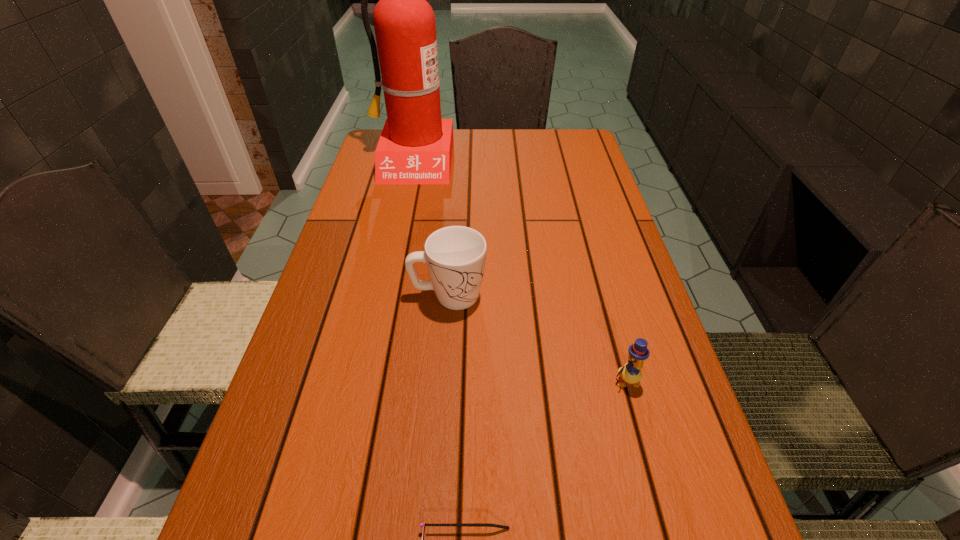
At what (x,y) coordinates should I click in order to perform the action: click on the tallest object. Please return your answer as a coordinate pair (x, y). Looking at the image, I should click on (415, 147).

You are a GUI agent. You are given a task and a screenshot of the screen. Output one action in this format:
    pyautogui.click(x=<x>, y=<y>)
    Task: Click on the farthest object
    
    Given the screenshot: What is the action you would take?
    pyautogui.click(x=415, y=147)

This screenshot has height=540, width=960. I want to click on mug, so click(x=455, y=256).

Find the location of `the second farthest object`. the second farthest object is located at coordinates (455, 256).

You are a GUI agent. You are given a task and a screenshot of the screen. Output one action in this format:
    pyautogui.click(x=<x>, y=<y>)
    Task: Click on the duckling
    
    Given the screenshot: What is the action you would take?
    pyautogui.click(x=631, y=373)

Where is `the rightmost object`? the rightmost object is located at coordinates (631, 373).

In order to click on free space located 0.300m on the front-facing side of the farthest object in this screenshot , I will do `click(393, 251)`.

Identify the location of vacant space located on the side of the second tallest object with the handle. This screenshot has width=960, height=540. (594, 295).

Identify the location of free region located on the face of the rightmost object, where the monocle is placed. (639, 427).

Identify the location of object at the far edge. (x=415, y=147).